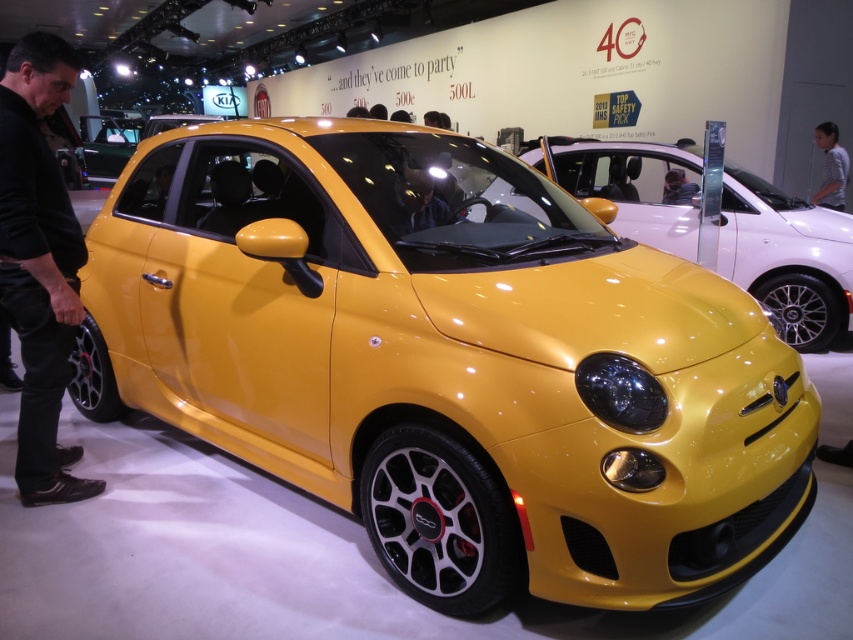
Which of these two, black leather pants at lower left or gray striped shirt at center, stands taller?

With more height is black leather pants at lower left.

Does black leather pants at lower left have a lesser width compared to gray striped shirt at center?

No, black leather pants at lower left is not thinner than gray striped shirt at center.

In order to click on black leather pants at lower left in this screenshot , I will do `click(39, 262)`.

I want to click on black leather pants at lower left, so click(x=39, y=262).

Does glossy yellow car at center have a greater width compared to gray striped shirt at center?

Indeed, glossy yellow car at center has a greater width compared to gray striped shirt at center.

Which is more to the right, glossy yellow car at center or gray striped shirt at center?

Positioned to the right is gray striped shirt at center.

The height and width of the screenshot is (640, 853). Describe the element at coordinates (787, 257) in the screenshot. I see `glossy yellow car at center` at that location.

What are the coordinates of `glossy yellow car at center` in the screenshot? It's located at (787, 257).

Does point (805, 250) lie in front of point (48, 468)?

No, (805, 250) is further to viewer.

Is glossy yellow car at center to the left of black leather pants at lower left from the viewer's perspective?

Incorrect, glossy yellow car at center is not on the left side of black leather pants at lower left.

Does point (842, 218) lie in front of point (1, 278)?

No.

Find the location of a particular element. The image size is (853, 640). glossy yellow car at center is located at coordinates (787, 257).